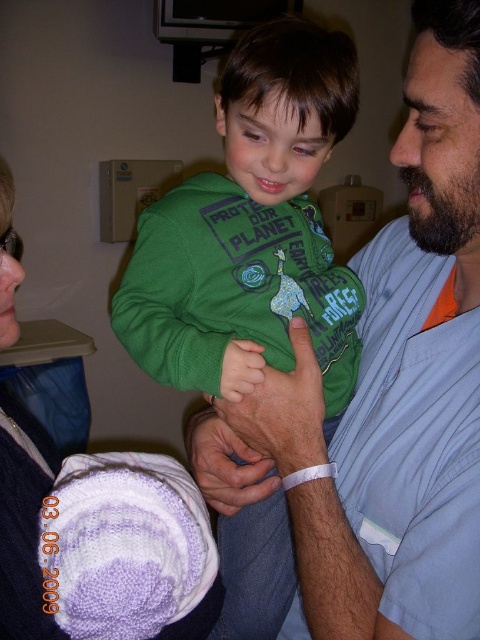
You are a nurse in the hospital room and need to hand a toy to the child wearing the green cotton hoodie at center and the adult in the knitted purple sweater at lower left. Which one is closer to the center of the room?

The green cotton hoodie at center is positioned on the right side of knitted purple sweater at lower left, so the green cotton hoodie at center is closer to the center of the room.

You are a visitor in the hospital room and want to approach the two points marked in the image. Which point, point (475, 124) or point (133, 620), is closer to you?

Point (475, 124) is closer to the viewer than point (133, 620).